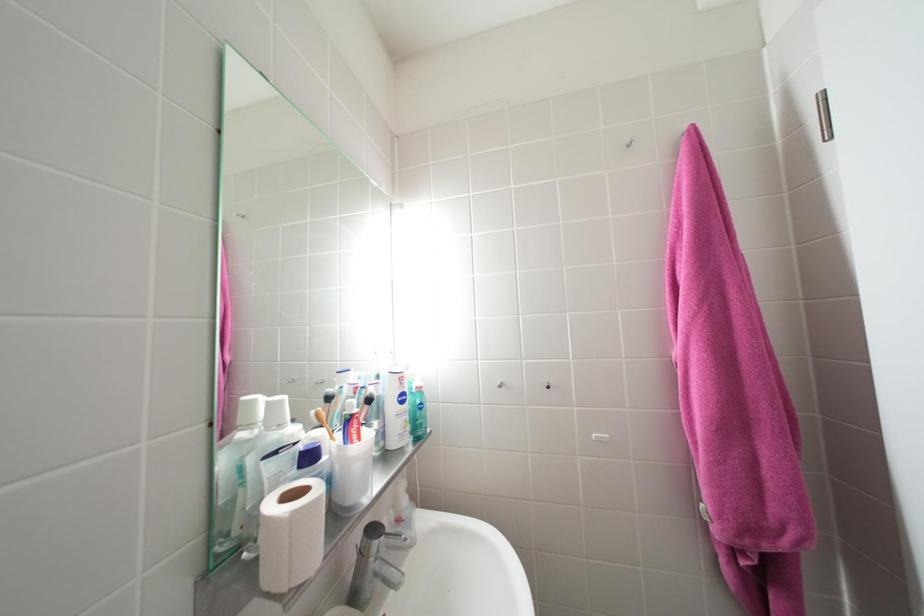
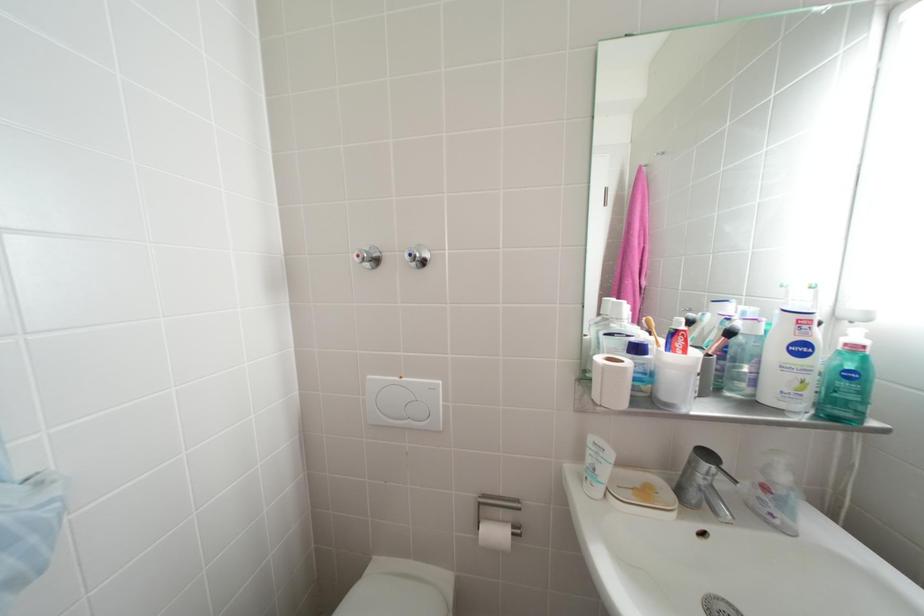
Question: The camera is either moving clockwise (left) or counter-clockwise (right) around the object. The first image is from the beginning of the video and the second image is from the end. Is the camera moving left or right when shooting the video?

Choices:
 (A) Left
 (B) Right

Answer: (B)